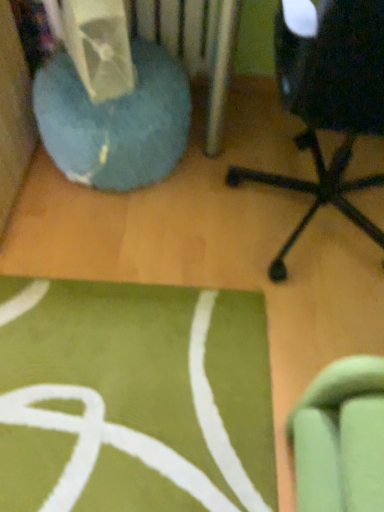
Question: Is blue fuzzy bean bag at left spatially inside black plastic chair at right, or outside of it?

Choices:
 (A) inside
 (B) outside

Answer: (B)

Question: Considering the relative positions of blue fuzzy bean bag at left and black plastic chair at right in the image provided, is blue fuzzy bean bag at left to the left or to the right of black plastic chair at right?

Choices:
 (A) left
 (B) right

Answer: (A)

Question: From their relative heights in the image, would you say blue fuzzy bean bag at left is taller or shorter than black plastic chair at right?

Choices:
 (A) tall
 (B) short

Answer: (B)

Question: Considering the positions of point (344, 181) and point (72, 144), is point (344, 181) closer or farther from the camera than point (72, 144)?

Choices:
 (A) farther
 (B) closer

Answer: (A)

Question: Is black plastic chair at right taller or shorter than blue fuzzy bean bag at left?

Choices:
 (A) short
 (B) tall

Answer: (B)

Question: In terms of size, does black plastic chair at right appear bigger or smaller than blue fuzzy bean bag at left?

Choices:
 (A) small
 (B) big

Answer: (B)

Question: From the image's perspective, is black plastic chair at right located above or below blue fuzzy bean bag at left?

Choices:
 (A) below
 (B) above

Answer: (A)